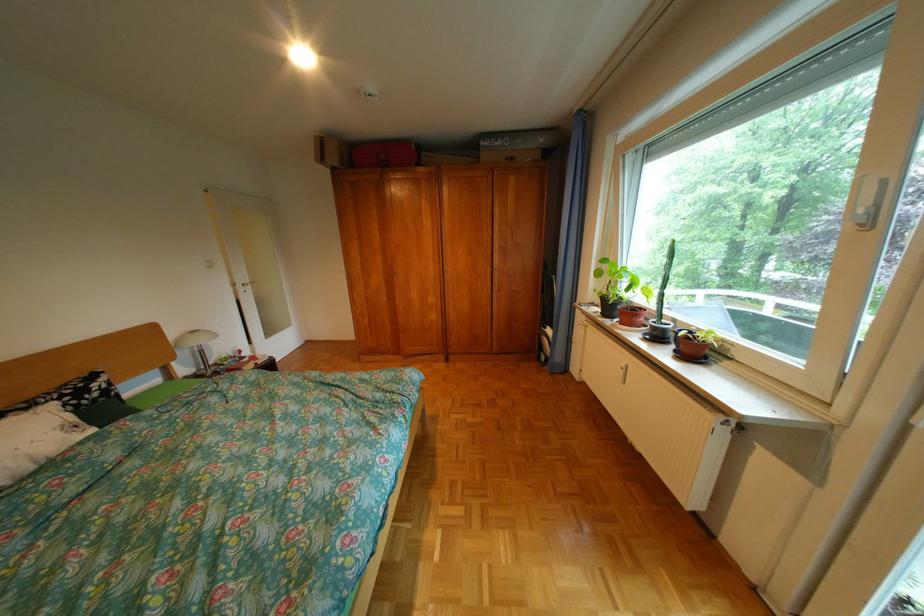
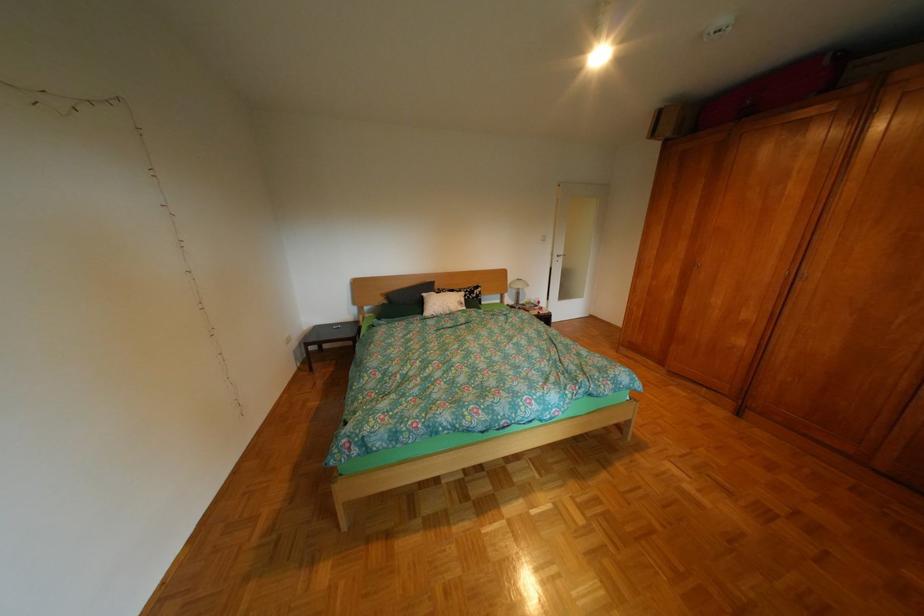
Where in the second image is the point corresponding to point (429, 148) from the first image?

(842, 63)